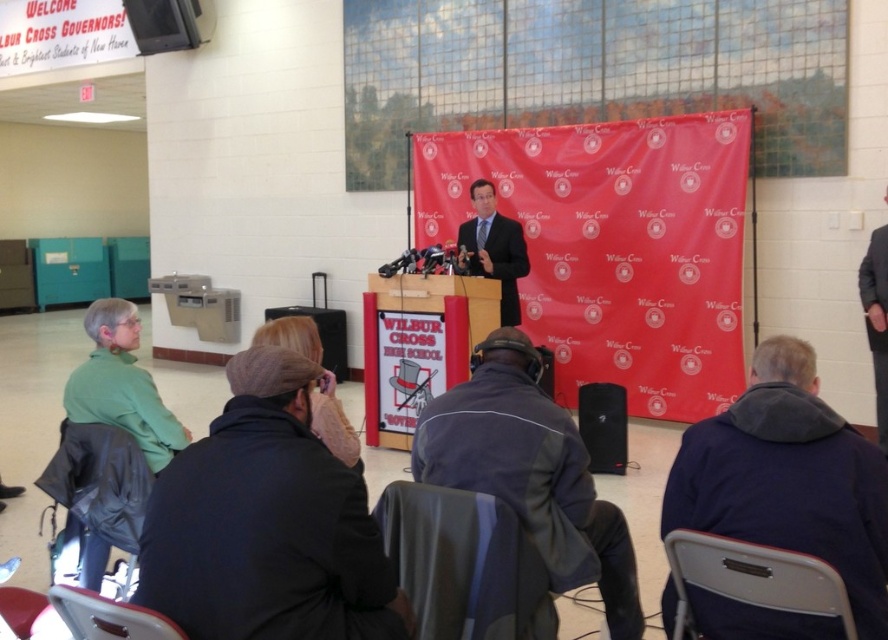
You are a photographer at the event and want to capture a clear photo of both the matte black suit at center and the black matte speaker at lower center. However, you notice that one is blocking the other. Which object is blocking the other?

The matte black suit at center is positioned over the black matte speaker at lower center, so the matte black suit at center is blocking the black matte speaker at lower center.

You are a photographer at the event and need to capture a clear shot of both the matte black suit at center and the black matte speaker at lower center. Since you want to ensure both are visible, which object should you focus on first considering their heights?

The matte black suit at center is taller than the black matte speaker at lower center, so you should focus on the matte black suit at center first to ensure proper focus and visibility.

You are an event planner arranging seating for the upcoming assembly at Wilbur Cross High School. You notice the green matte shirt at left and the metallic gray chair at lower left. Which object is located above the other?

The green matte shirt at left is positioned over the metallic gray chair at lower left, meaning it is above the chair.